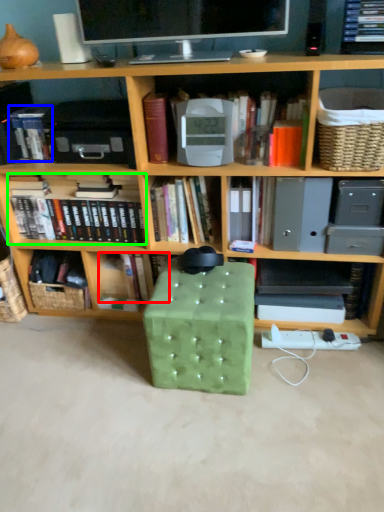
Question: Which is nearer to the book (highlighted by a red box)? book (highlighted by a blue box) or book (highlighted by a green box).

Choices:
 (A) book
 (B) book

Answer: (B)